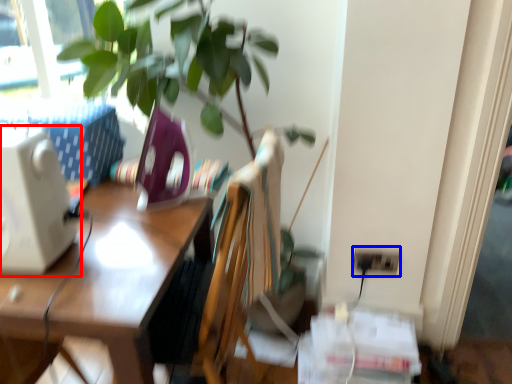
Question: Which object is further to the camera taking this photo, desktop computer (highlighted by a red box) or electric outlet (highlighted by a blue box)?

Choices:
 (A) desktop computer
 (B) electric outlet

Answer: (B)